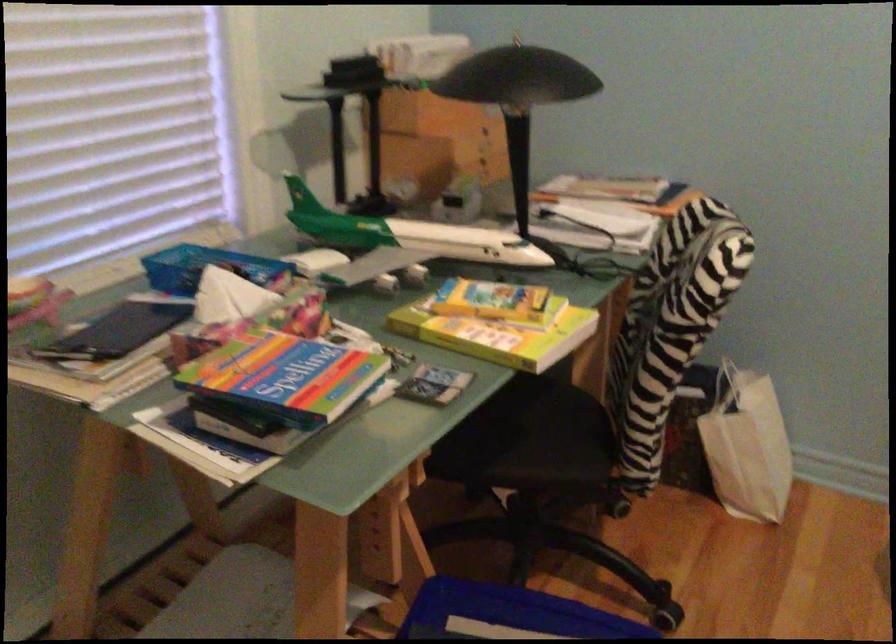
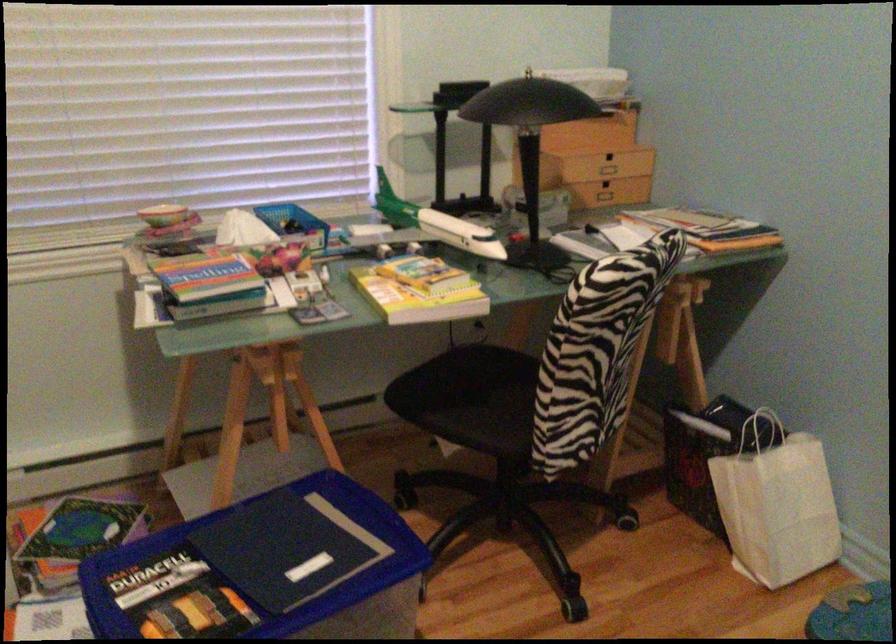
In the second image, find the point that corresponds to point 500,404 in the first image.

(487, 377)